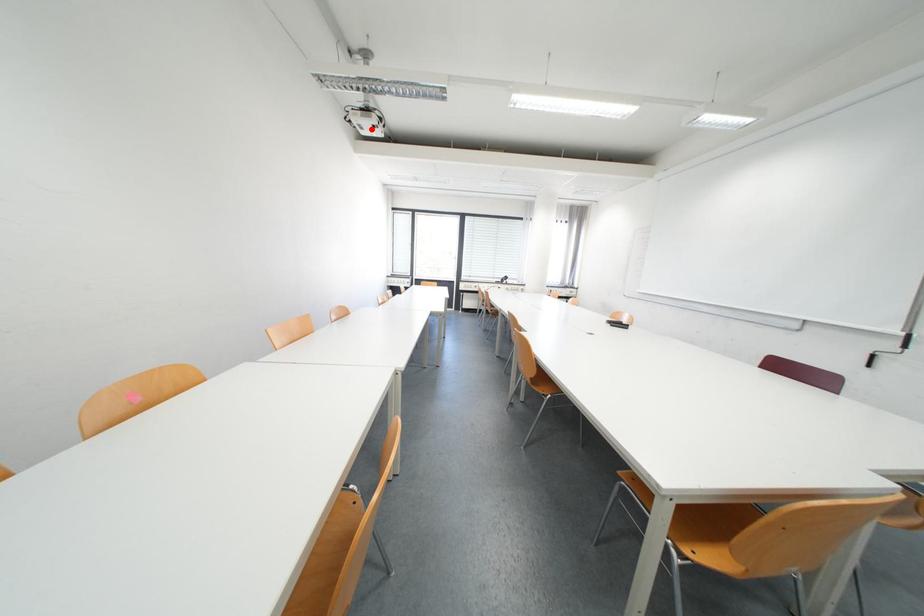
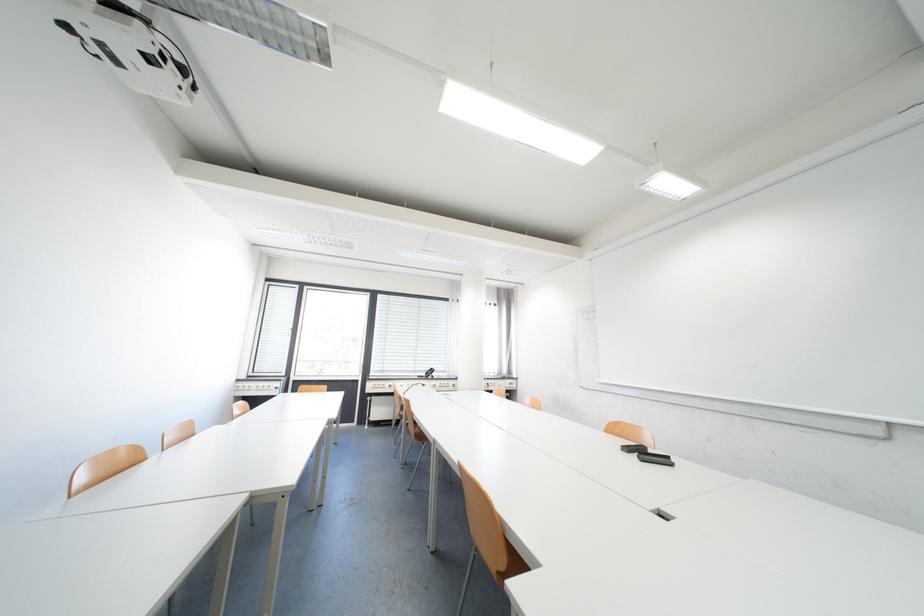
Question: A red point is marked in image1. In image2, is the corresponding 3D point closer to the camera or farther? Reply with the corresponding letter.

Choices:
 (A) The corresponding 3D point is closer.
 (B) The corresponding 3D point is farther.

Answer: (B)